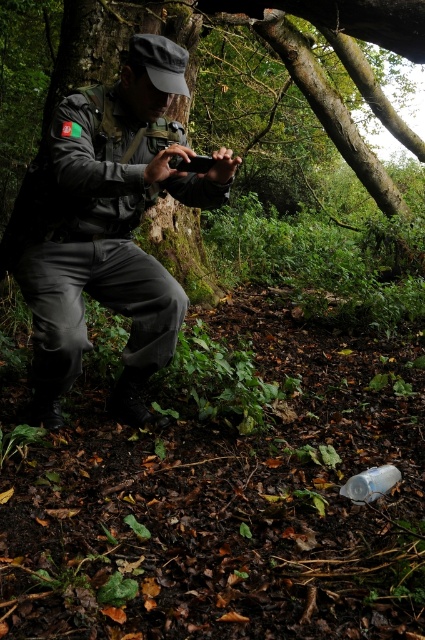
Question: Among these objects, which one is farthest from the camera?

Choices:
 (A) transparent plastic bottle at lower center
 (B) green mossy tree trunk at center

Answer: (B)

Question: Observing the image, what is the correct spatial positioning of green mossy tree trunk at center in reference to transparent plastic bottle at lower center?

Choices:
 (A) below
 (B) above

Answer: (B)

Question: Considering the relative positions of green mossy tree trunk at center and transparent plastic bottle at lower center in the image provided, where is green mossy tree trunk at center located with respect to transparent plastic bottle at lower center?

Choices:
 (A) above
 (B) below

Answer: (A)

Question: Observing the image, what is the correct spatial positioning of matte black uniform at center in reference to green mossy tree trunk at center?

Choices:
 (A) above
 (B) below

Answer: (B)

Question: Among these objects, which one is nearest to the camera?

Choices:
 (A) green mossy tree trunk at center
 (B) matte black uniform at center

Answer: (B)

Question: Which point is farther to the camera?

Choices:
 (A) (277, 29)
 (B) (127, 371)
 (C) (343, 492)

Answer: (A)